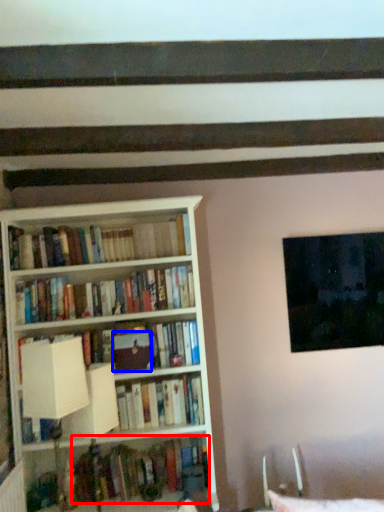
Question: Which object is further to the camera taking this photo, book (highlighted by a red box) or paperback book (highlighted by a blue box)?

Choices:
 (A) book
 (B) paperback book

Answer: (B)